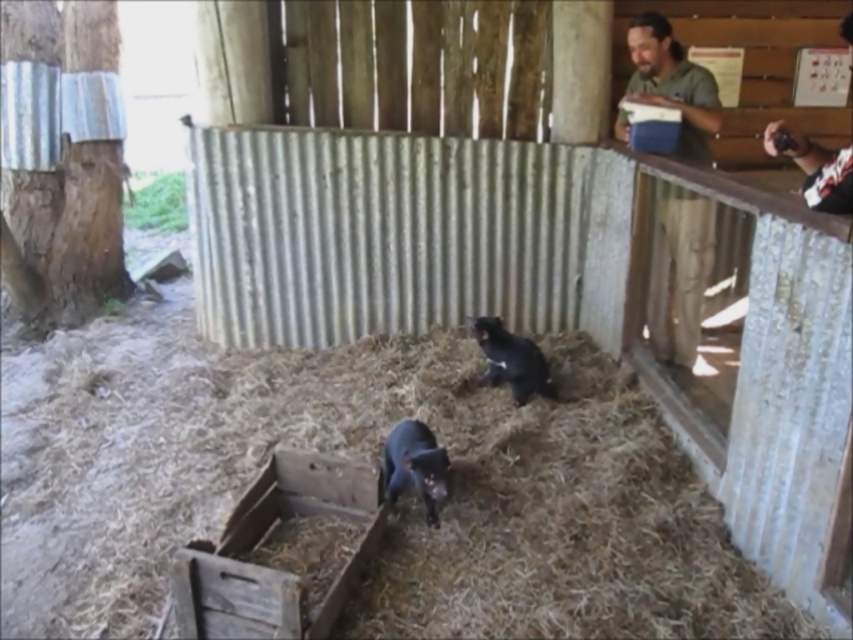
Which is behind, point (363, 490) or point (807, 150)?

Point (363, 490)

Between rusty wooden crate at lower left and white shirt at upper right, which one is positioned lower?

rusty wooden crate at lower left is below.

Which is in front, point (236, 538) or point (804, 147)?

Point (236, 538)

I want to click on rusty wooden crate at lower left, so click(x=274, y=568).

What do you see at coordinates (274, 568) in the screenshot?
I see `rusty wooden crate at lower left` at bounding box center [274, 568].

Is rusty wooden crate at lower left closer to camera compared to green matte shirt at upper right?

That is True.

Is point (257, 518) positioned before point (669, 90)?

Yes, it is.

Find the location of a particular element. rusty wooden crate at lower left is located at coordinates (274, 568).

Does green matte shirt at upper right have a greater width compared to black matte animal at center?

Correct, the width of green matte shirt at upper right exceeds that of black matte animal at center.

Can you confirm if green matte shirt at upper right is thinner than black matte animal at center?

In fact, green matte shirt at upper right might be wider than black matte animal at center.

What do you see at coordinates (672, 83) in the screenshot? This screenshot has height=640, width=853. I see `green matte shirt at upper right` at bounding box center [672, 83].

Locate an element on the screen. The image size is (853, 640). green matte shirt at upper right is located at coordinates (672, 83).